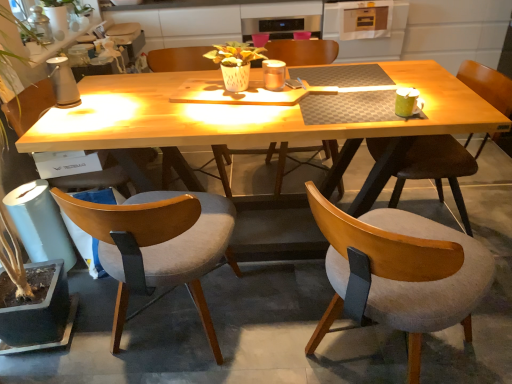
This screenshot has width=512, height=384. Find the location of `wooden upholstered chair at right, placed as the fifth chair when sorted from left to right`. wooden upholstered chair at right, placed as the fifth chair when sorted from left to right is located at coordinates (438, 168).

What do you see at coordinates (403, 271) in the screenshot? I see `wooden chair at center, the second chair in the right-to-left sequence` at bounding box center [403, 271].

Find the location of a particular element. Image resolution: width=512 pixels, height=384 pixels. metallic silver oven at upper center is located at coordinates (366, 37).

Describe the element at coordinates (158, 245) in the screenshot. This screenshot has height=384, width=512. I see `light gray fabric chair at lower left, the 4th chair positioned from the right` at that location.

Describe the element at coordinates (29, 106) in the screenshot. I see `light brown wood chair at lower left, which appears as the first chair when viewed from the left` at that location.

Identify the location of wooden upholstered chair at right, which appears as the 1th chair when viewed from the right. The image size is (512, 384). (438, 168).

From a real-world perspective, which is physically above, wooden upholstered chair at right, which appears as the 1th chair when viewed from the right, or wooden chair at center, arranged as the third chair when viewed from the left?

wooden upholstered chair at right, which appears as the 1th chair when viewed from the right, from a real-world perspective.

Is wooden upholstered chair at right, which appears as the 1th chair when viewed from the right, not close to wooden chair at center, arranged as the third chair when viewed from the left?

Yes, wooden upholstered chair at right, which appears as the 1th chair when viewed from the right, is far from wooden chair at center, arranged as the third chair when viewed from the left.

Who is bigger, wooden upholstered chair at right, placed as the fifth chair when sorted from left to right, or wooden chair at center, arranged as the third chair when viewed from the left?

With larger size is wooden upholstered chair at right, placed as the fifth chair when sorted from left to right.

How distant is wooden upholstered chair at right, placed as the fifth chair when sorted from left to right, from wooden chair at center, arranged as the third chair when viewed from the left?

wooden upholstered chair at right, placed as the fifth chair when sorted from left to right, is 1.29 meters from wooden chair at center, arranged as the third chair when viewed from the left.

In terms of width, does metallic silver oven at upper center look wider or thinner when compared to wooden chair at center, the second chair in the right-to-left sequence?

In the image, metallic silver oven at upper center appears to be wider than wooden chair at center, the second chair in the right-to-left sequence.

Does metallic silver oven at upper center have a smaller size compared to wooden chair at center, the second chair in the right-to-left sequence?

No.

Could wooden chair at center, acting as the 4th chair starting from the left, be considered to be inside metallic silver oven at upper center?

Definitely not — wooden chair at center, acting as the 4th chair starting from the left, is not inside metallic silver oven at upper center.

From a real-world perspective, which is physically below, metallic silver oven at upper center or wooden chair at center, acting as the 4th chair starting from the left?

In real-world perspective, wooden chair at center, acting as the 4th chair starting from the left, is lower.

From the image's perspective, which one is positioned higher, green leafy plant at left or light brown wood chair at lower left, which appears as the first chair when viewed from the left?

From the image's view, light brown wood chair at lower left, which appears as the first chair when viewed from the left, is above.

Is green leafy plant at left surrounding light brown wood chair at lower left, which appears as the first chair when viewed from the left?

No, light brown wood chair at lower left, which appears as the first chair when viewed from the left, is located outside of green leafy plant at left.

This screenshot has width=512, height=384. I want to click on houseplant that appears below the light brown wood chair at lower left, which appears as the first chair when viewed from the left (from the image's perspective), so click(42, 225).

What's the angular difference between green leafy plant at left and light brown wood chair at lower left, which appears as the first chair when viewed from the left,'s facing directions?

1.23 degrees separate the facing orientations of green leafy plant at left and light brown wood chair at lower left, which appears as the first chair when viewed from the left.

Does light gray fabric chair at lower left, which is the 2th chair in left-to-right order, have a lesser width compared to wooden upholstered chair at right, placed as the fifth chair when sorted from left to right?

No, light gray fabric chair at lower left, which is the 2th chair in left-to-right order, is not thinner than wooden upholstered chair at right, placed as the fifth chair when sorted from left to right.

Is light gray fabric chair at lower left, the 4th chair positioned from the right, placed right next to wooden upholstered chair at right, placed as the fifth chair when sorted from left to right?

No.

Is light gray fabric chair at lower left, the 4th chair positioned from the right, not within wooden upholstered chair at right, placed as the fifth chair when sorted from left to right?

Indeed, light gray fabric chair at lower left, the 4th chair positioned from the right, is completely outside wooden upholstered chair at right, placed as the fifth chair when sorted from left to right.

Between light brown wood chair at lower left, arranged as the fifth chair when viewed from the right, and light gray fabric chair at lower left, the 4th chair positioned from the right, which one is positioned behind?

light brown wood chair at lower left, arranged as the fifth chair when viewed from the right, is further away from the camera.

Locate an element on the screen. This screenshot has width=512, height=384. the 4th chair located beneath the light brown wood chair at lower left, arranged as the fifth chair when viewed from the right (from a real-world perspective) is located at coordinates (158, 245).

Is light brown wood chair at lower left, which appears as the first chair when viewed from the left, facing towards light gray fabric chair at lower left, the 4th chair positioned from the right?

No, light brown wood chair at lower left, which appears as the first chair when viewed from the left, is not turned towards light gray fabric chair at lower left, the 4th chair positioned from the right.

Who is shorter, light brown wood chair at lower left, which appears as the first chair when viewed from the left, or light gray fabric chair at lower left, which is the 2th chair in left-to-right order?

light gray fabric chair at lower left, which is the 2th chair in left-to-right order.

Is light brown wood chair at lower left, arranged as the fifth chair when viewed from the right, turned away from wooden chair at center, acting as the 4th chair starting from the left?

No, light brown wood chair at lower left, arranged as the fifth chair when viewed from the right, is not facing away from wooden chair at center, acting as the 4th chair starting from the left.

Considering the positions of objects light brown wood chair at lower left, arranged as the fifth chair when viewed from the right, and wooden chair at center, the second chair in the right-to-left sequence, in the image provided, who is more to the right, light brown wood chair at lower left, arranged as the fifth chair when viewed from the right, or wooden chair at center, the second chair in the right-to-left sequence,?

From the viewer's perspective, wooden chair at center, the second chair in the right-to-left sequence, appears more on the right side.

Is the depth of light brown wood chair at lower left, which appears as the first chair when viewed from the left, less than that of wooden chair at center, the second chair in the right-to-left sequence?

No, it is not.

Is green leafy plant at left at the left side of metallic silver oven at upper center?

Indeed, green leafy plant at left is positioned on the left side of metallic silver oven at upper center.

Considering the sizes of objects green leafy plant at left and metallic silver oven at upper center in the image provided, who is bigger, green leafy plant at left or metallic silver oven at upper center?

green leafy plant at left.

Is green leafy plant at left located outside metallic silver oven at upper center?

Yes, green leafy plant at left is not within metallic silver oven at upper center.

From a real-world perspective, relative to metallic silver oven at upper center, is green leafy plant at left vertically above or below?

Clearly, from a real-world perspective, green leafy plant at left is above metallic silver oven at upper center.

Locate an element on the screen. Image resolution: width=512 pixels, height=384 pixels. the 2nd chair in front of the wooden chair at center, which appears as the third chair when viewed from the right, counting from the anchor's position is located at coordinates (438, 168).

The image size is (512, 384). I want to click on kitchen appliance on the right of the wooden chair at center, acting as the 4th chair starting from the left, so click(x=366, y=37).

From the image, which object appears to be farther from light gray fabric chair at lower left, which is the 2th chair in left-to-right order, light brown wood chair at lower left, which appears as the first chair when viewed from the left, or wooden upholstered chair at right, which appears as the 1th chair when viewed from the right?

wooden upholstered chair at right, which appears as the 1th chair when viewed from the right.

Which object lies nearer to the anchor point green leafy plant at left, light gray fabric chair at lower left, the 4th chair positioned from the right, or light brown wood chair at lower left, arranged as the fifth chair when viewed from the right?

light brown wood chair at lower left, arranged as the fifth chair when viewed from the right, is positioned closer to the anchor green leafy plant at left.

Based on their spatial positions, is light gray fabric chair at lower left, which is the 2th chair in left-to-right order, or light brown wood chair at lower left, which appears as the first chair when viewed from the left, closer to wooden chair at center, arranged as the third chair when viewed from the left?

Based on the image, light brown wood chair at lower left, which appears as the first chair when viewed from the left, appears to be nearer to wooden chair at center, arranged as the third chair when viewed from the left.

Considering their positions, is wooden upholstered chair at right, placed as the fifth chair when sorted from left to right, positioned closer to wooden chair at center, which appears as the third chair when viewed from the right, than light brown wood chair at lower left, arranged as the fifth chair when viewed from the right?

Based on the image, wooden upholstered chair at right, placed as the fifth chair when sorted from left to right, appears to be nearer to wooden chair at center, which appears as the third chair when viewed from the right.

Looking at this image, which object lies further to the anchor point green leafy plant at left, wooden chair at center, the second chair in the right-to-left sequence, or light gray fabric chair at lower left, which is the 2th chair in left-to-right order?

wooden chair at center, the second chair in the right-to-left sequence, lies further to green leafy plant at left than the other object.

Which object lies further to the anchor point light gray fabric chair at lower left, the 4th chair positioned from the right, wooden upholstered chair at right, placed as the fifth chair when sorted from left to right, or wooden chair at center, which appears as the third chair when viewed from the right?

wooden chair at center, which appears as the third chair when viewed from the right, is positioned further to the anchor light gray fabric chair at lower left, the 4th chair positioned from the right.

Considering their positions, is wooden upholstered chair at right, which appears as the 1th chair when viewed from the right, positioned closer to metallic silver oven at upper center than light brown wood chair at lower left, arranged as the fifth chair when viewed from the right?

Among the two, wooden upholstered chair at right, which appears as the 1th chair when viewed from the right, is located nearer to metallic silver oven at upper center.

Based on the photo, which object lies further to the anchor point green leafy plant at left, wooden chair at center, acting as the 4th chair starting from the left, or wooden chair at center, which appears as the third chair when viewed from the right?

Based on the image, wooden chair at center, which appears as the third chair when viewed from the right, appears to be further to green leafy plant at left.

This screenshot has width=512, height=384. I want to click on kitchen appliance between light brown wood chair at lower left, arranged as the fifth chair when viewed from the right, and wooden upholstered chair at right, which appears as the 1th chair when viewed from the right, so click(x=366, y=37).

I want to click on chair between light brown wood chair at lower left, arranged as the fifth chair when viewed from the right, and wooden chair at center, which appears as the third chair when viewed from the right, in the horizontal direction, so click(158, 245).